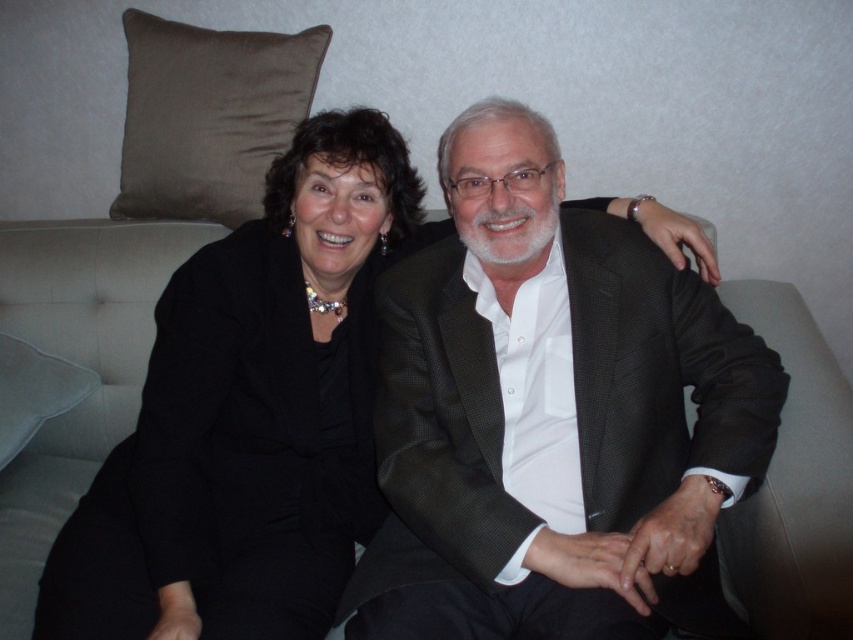
In the scene shown: You are a photographer setting up a shoot in this living room. You notice the matte black suit at center and the brown suede pillow at upper left. Where should you place your camera to ensure both items are visible in the frame?

Place the camera at a higher angle so that the matte black suit at center, which is positioned under the brown suede pillow at upper left, can be seen below the pillow in the frame.

You are designing a seating arrangement for a small living room. You have two pillows available, the brown suede pillow at upper left and the white fabric pillow at left. Which pillow should you choose if you want to add a larger decorative element to the sofa?

The brown suede pillow at upper left is larger in size than the white fabric pillow at left, so you should choose the brown suede pillow at upper left to add a larger decorative element to the sofa.

You are arranging a cozy seating area and want to place both the brown suede pillow at upper left and the white fabric pillow at left on the sofa. According to the image, which pillow should you place on the left side to maintain the original arrangement?

To maintain the original arrangement, place the white fabric pillow at left on the left side since the brown suede pillow at upper left is to the right of it.